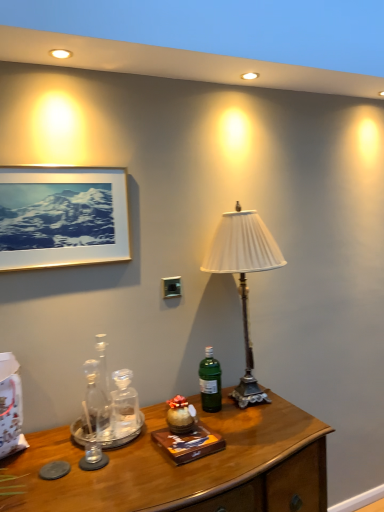
Question: From a real-world perspective, is white pleated fabric lampshade at center physically located above or below wooden desk at lower center?

Choices:
 (A) above
 (B) below

Answer: (A)

Question: Based on their sizes in the image, would you say white pleated fabric lampshade at center is bigger or smaller than wooden desk at lower center?

Choices:
 (A) small
 (B) big

Answer: (A)

Question: Which of these objects is positioned farthest from the gold-framed picture at upper left?

Choices:
 (A) white pleated fabric lampshade at center
 (B) green glass bottle at center
 (C) wooden desk at lower center

Answer: (C)

Question: Based on their relative distances, which object is nearer to the green glass bottle at center?

Choices:
 (A) white pleated fabric lampshade at center
 (B) wooden desk at lower center
 (C) gold-framed picture at upper left

Answer: (B)